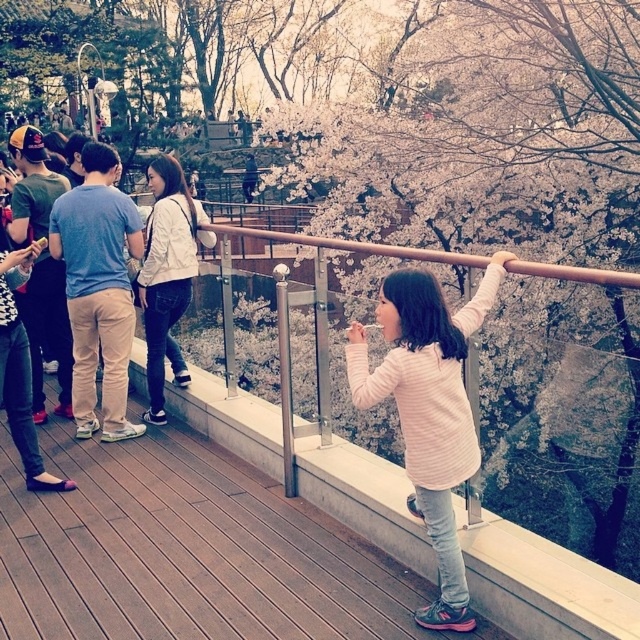
Question: Estimate the real-world distances between objects in this image. Which object is closer to the white matte jacket at upper center?

Choices:
 (A) wooden at center
 (B) pink striped shirt at center

Answer: (A)

Question: Can you confirm if pink striped shirt at center is smaller than white matte jacket at upper center?

Choices:
 (A) no
 (B) yes

Answer: (A)

Question: Can you confirm if wooden at center is bigger than white matte jacket at upper center?

Choices:
 (A) no
 (B) yes

Answer: (B)

Question: Is the position of wooden at center more distant than that of white matte jacket at upper center?

Choices:
 (A) no
 (B) yes

Answer: (A)

Question: Which point is farther to the camera?

Choices:
 (A) white matte jacket at upper center
 (B) pink striped shirt at center

Answer: (A)

Question: Which is farther from the white matte jacket at upper center?

Choices:
 (A) wooden at center
 (B) pink striped shirt at center

Answer: (B)